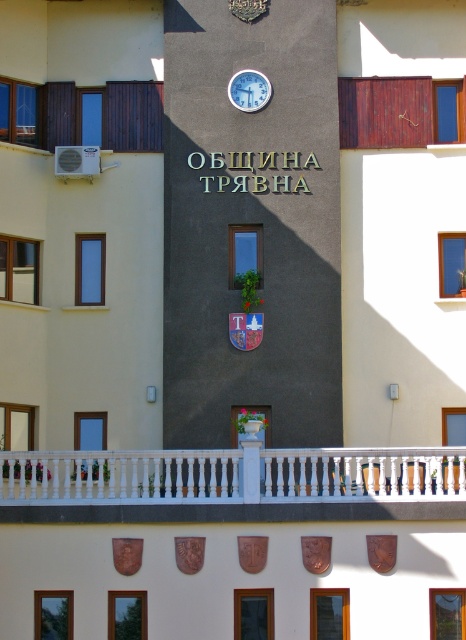
You are standing in front of the building and want to take a photo. If you focus on point A at point coordinates point (300,483) and point B at point (248,99), which point will appear larger in your photo?

Point A at point coordinates point (300,483) will appear larger in the photo because it is closer to the camera than point B at point (248,99).

You are a visitor standing in front of the building and want to check the time on the white plastic clock at upper center. However, there is a white wooden railing at center blocking your view. Can you see the clock clearly?

The white wooden railing at center is taller than the white plastic clock at upper center, so the railing is blocking the view of the clock. You cannot see the clock clearly.

Consider the image. You are standing at the base of the building shown in the image. You want to reach the point marked as point (424, 468) on the building facade. Given that the building is 100 meters tall, can you estimate how high you need to climb to reach that point?

The point (424, 468) is located 57.78 meters above the ground. Since the building is 100 meters tall, you would need to climb approximately 57.78 meters to reach that point.